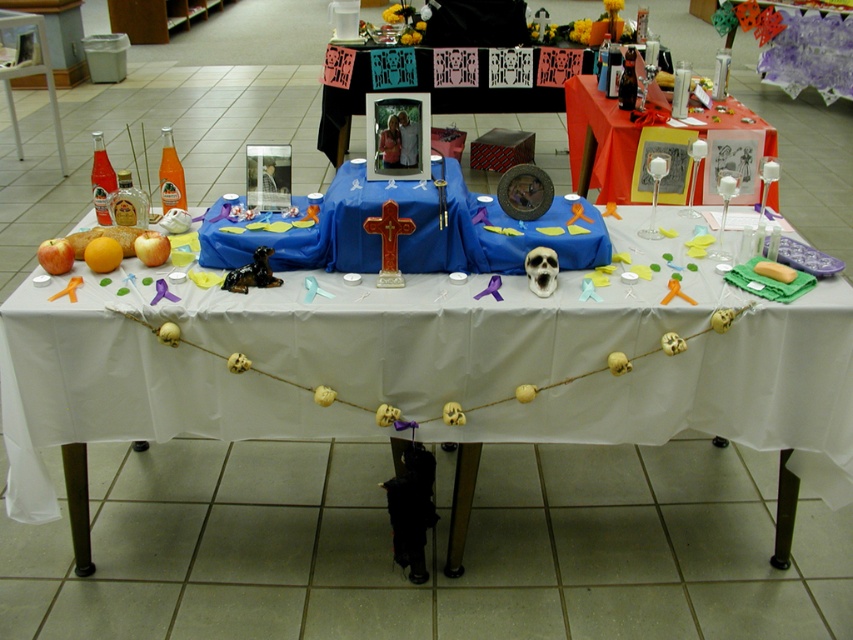
Question: Which object is the closest to the matte black frame at upper center?

Choices:
 (A) translucent glass candlesticks at upper right
 (B) white fabric table at center

Answer: (A)

Question: Does white fabric table at center appear on the right side of translucent glass candlesticks at upper right?

Choices:
 (A) yes
 (B) no

Answer: (B)

Question: Which object is closer to the camera taking this photo?

Choices:
 (A) matte black frame at upper center
 (B) white fabric table at center
 (C) translucent glass candlesticks at upper right

Answer: (B)

Question: Is white fabric table at center smaller than matte black frame at upper center?

Choices:
 (A) yes
 (B) no

Answer: (B)

Question: Which of these objects is positioned closest to the translucent glass candlesticks at upper right?

Choices:
 (A) white fabric table at center
 (B) matte black frame at upper center

Answer: (B)

Question: Is the position of white fabric table at center less distant than that of matte black frame at upper center?

Choices:
 (A) no
 (B) yes

Answer: (B)